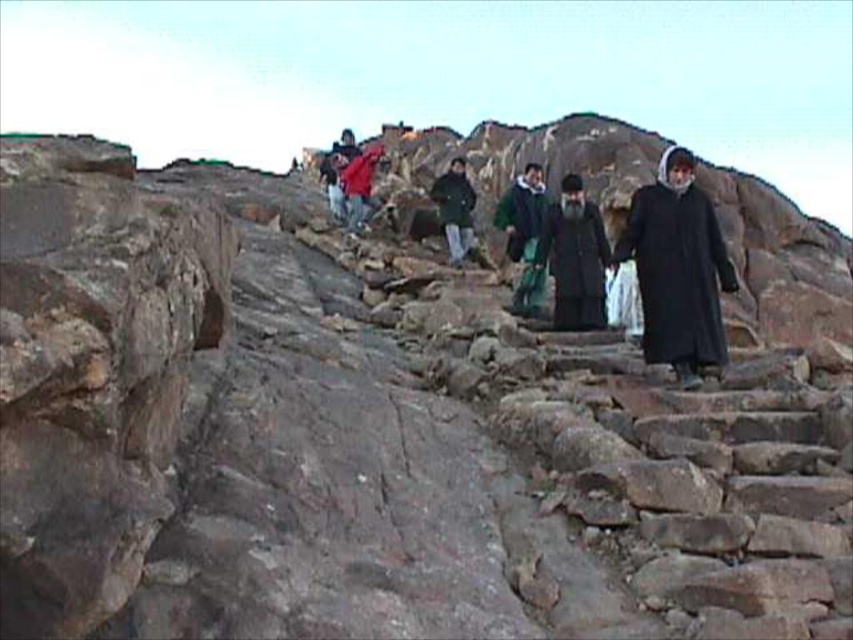
Question: Which point is farther to the camera?

Choices:
 (A) green fabric coat at center
 (B) black matte robe at center
 (C) black matte robe at right

Answer: (A)

Question: Can you confirm if black matte robe at center is positioned to the right of dark green fabric jacket at center?

Choices:
 (A) no
 (B) yes

Answer: (B)

Question: Which object is positioned farthest from the dark green fabric jacket at center?

Choices:
 (A) green fabric coat at center
 (B) black matte robe at right

Answer: (B)

Question: Which point is closer to the camera?

Choices:
 (A) (469, 218)
 (B) (531, 300)
 (C) (567, 296)

Answer: (C)

Question: Does black matte robe at center appear on the left side of dark green fabric jacket at center?

Choices:
 (A) yes
 (B) no

Answer: (B)

Question: Does black matte robe at center appear on the right side of green fabric coat at center?

Choices:
 (A) no
 (B) yes

Answer: (B)